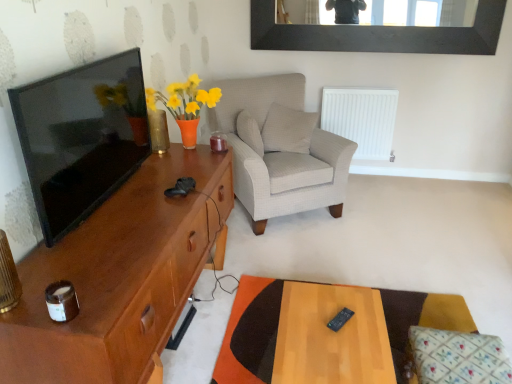
The image size is (512, 384). What are the coordinates of `vacant area located to the right-hand side of black plastic remote at center` in the screenshot? It's located at (370, 322).